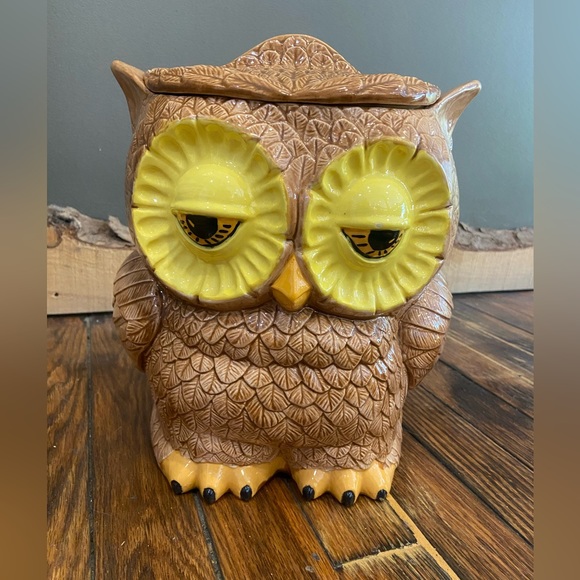
Where is `owl statue`? The height and width of the screenshot is (580, 580). owl statue is located at coordinates (239, 101), (310, 373), (223, 400), (331, 139).